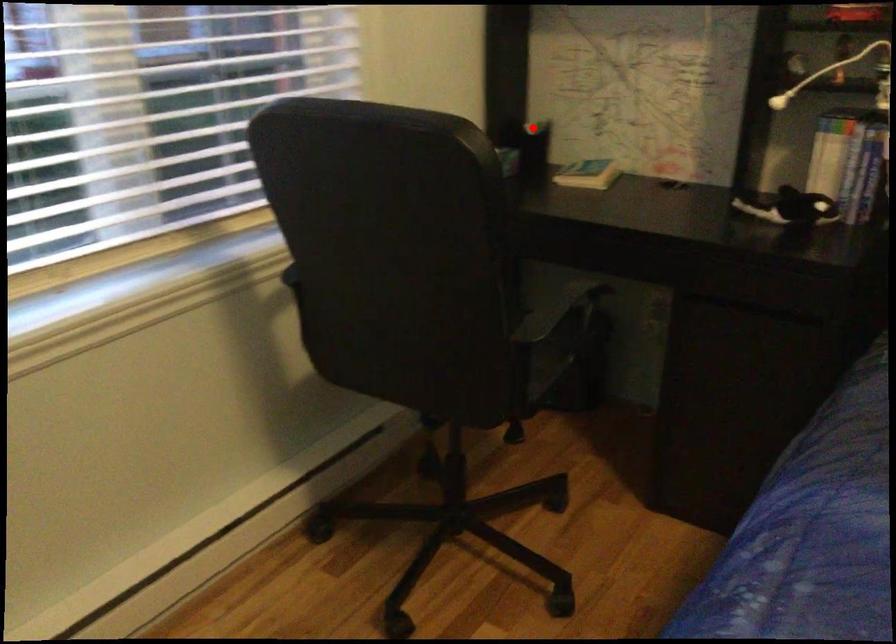
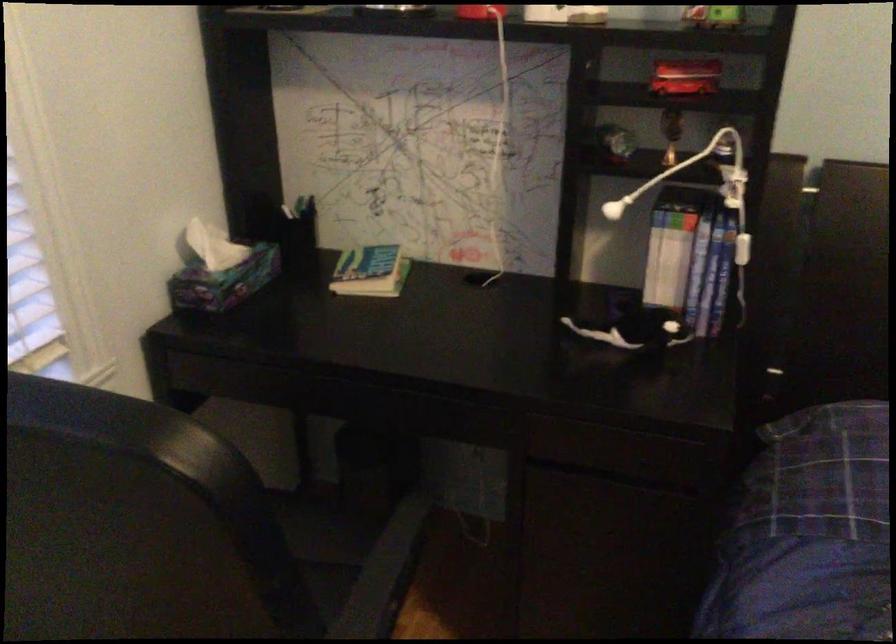
Question: I am providing you with two images of the same scene from different viewpoints. A red point is marked on the first image. At the location where the point appears in image 1, is it still visible in image 2?

Choices:
 (A) Yes
 (B) No

Answer: (A)